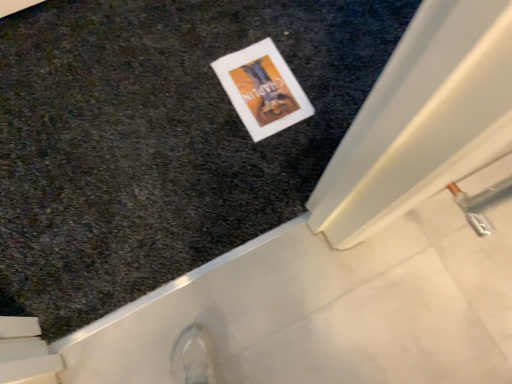
The width and height of the screenshot is (512, 384). Find the location of `unoccupied region to the right of white paper at center`. unoccupied region to the right of white paper at center is located at coordinates (329, 86).